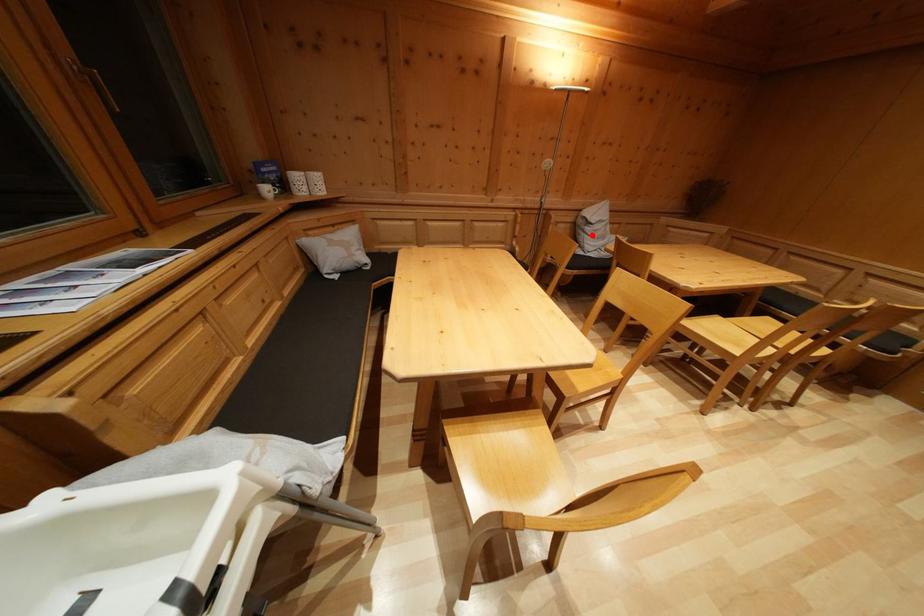
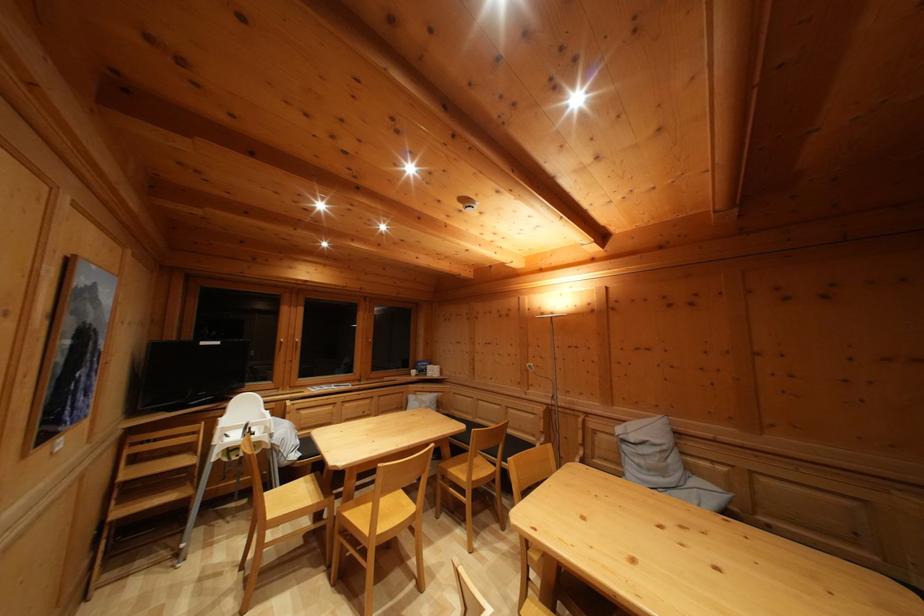
Question: I am providing you with two images of the same scene from different viewpoints. Image1 has a red point marked. In image2, the corresponding 3D location appears at what relative position? Reply with the corresponding letter.

Choices:
 (A) Closer
 (B) Farther

Answer: (B)